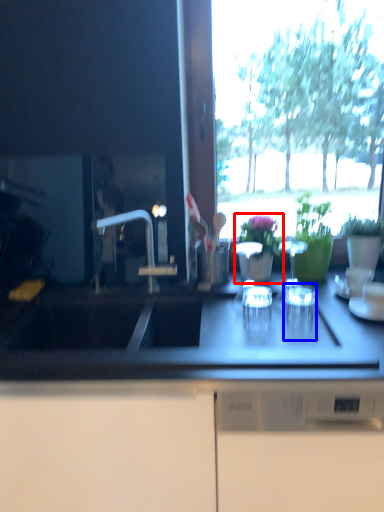
Question: Which point is further to the camera, houseplant (highlighted by a red box) or tableware (highlighted by a blue box)?

Choices:
 (A) houseplant
 (B) tableware

Answer: (A)